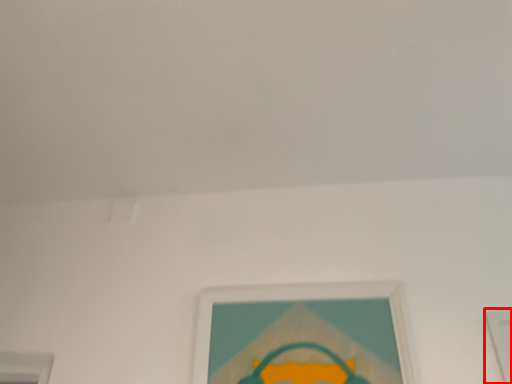
Question: From the image's perspective, what is the correct spatial positioning of picture frame (annotated by the red box) in reference to picture frame?

Choices:
 (A) below
 (B) above

Answer: (A)